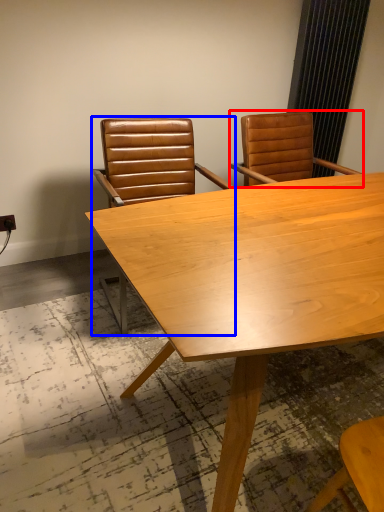
Question: Which object appears farthest to the camera in this image, chair (highlighted by a red box) or chair (highlighted by a blue box)?

Choices:
 (A) chair
 (B) chair

Answer: (A)